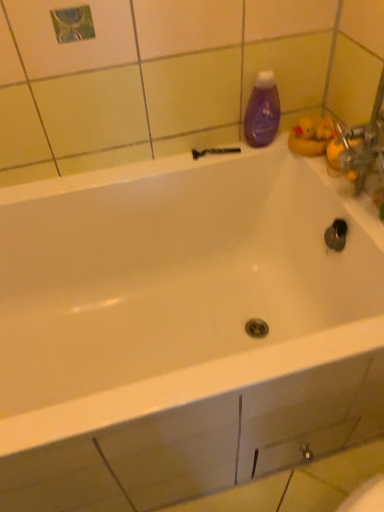
You are a GUI agent. You are given a task and a screenshot of the screen. Output one action in this format:
    pyautogui.click(x=<x>, y=<y>)
    Task: Click on the vacant space that is to the left of black plastic shower at upper center
    
    Given the screenshot: What is the action you would take?
    pyautogui.click(x=161, y=166)